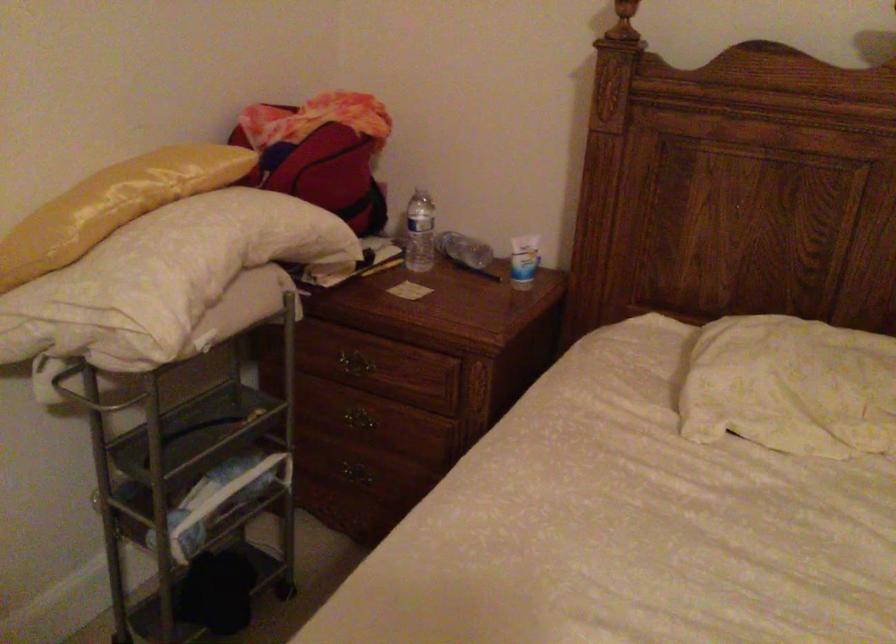
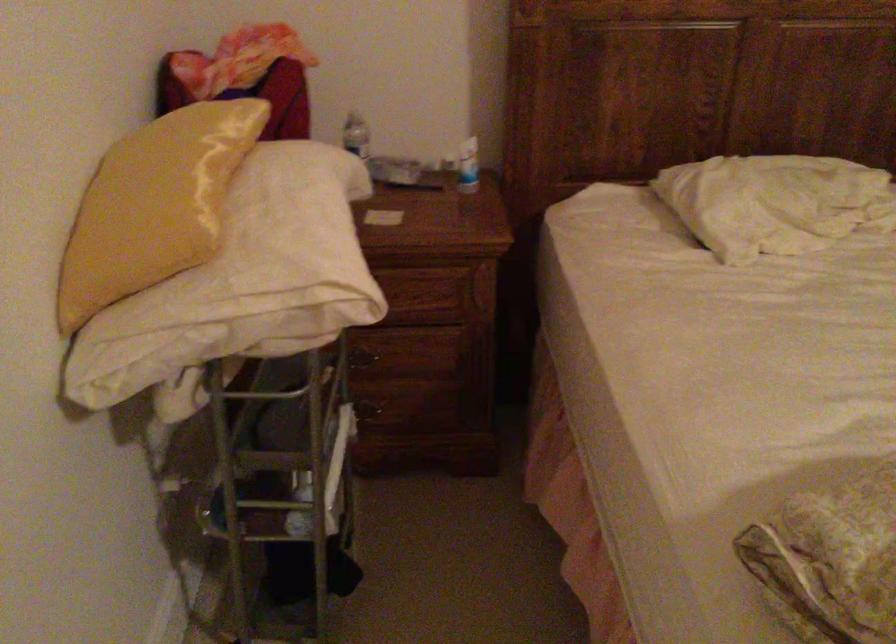
The point at [401,444] is marked in the first image. Where is the corresponding point in the second image?

(412, 365)